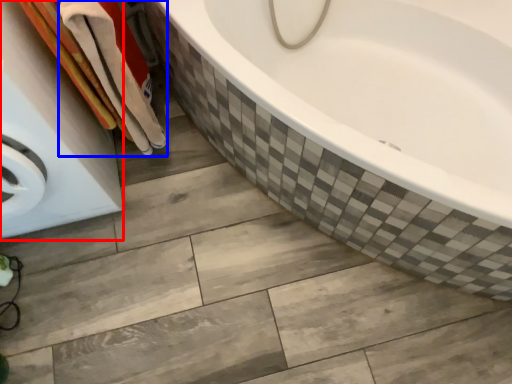
Question: Which object is closer to the camera taking this photo, washing machine (highlighted by a red box) or bath towel (highlighted by a blue box)?

Choices:
 (A) washing machine
 (B) bath towel

Answer: (A)